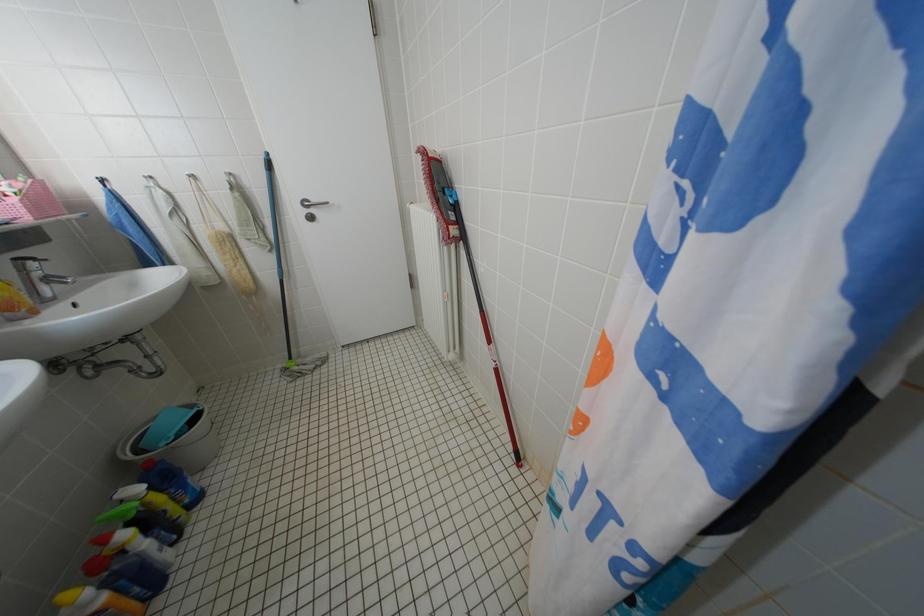
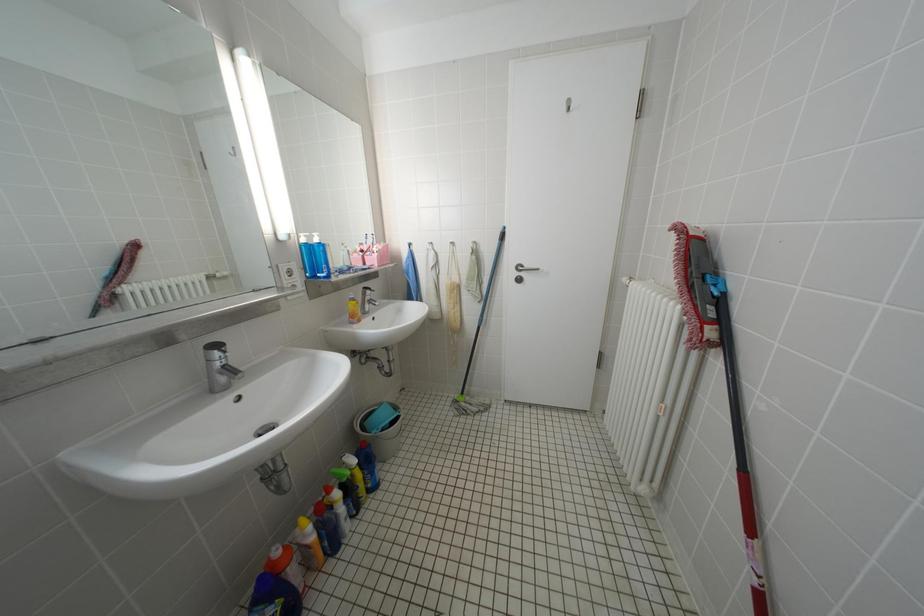
Question: The camera is either moving clockwise (left) or counter-clockwise (right) around the object. The first image is from the beginning of the video and the second image is from the end. Is the camera moving left or right when shooting the video?

Choices:
 (A) Left
 (B) Right

Answer: (B)